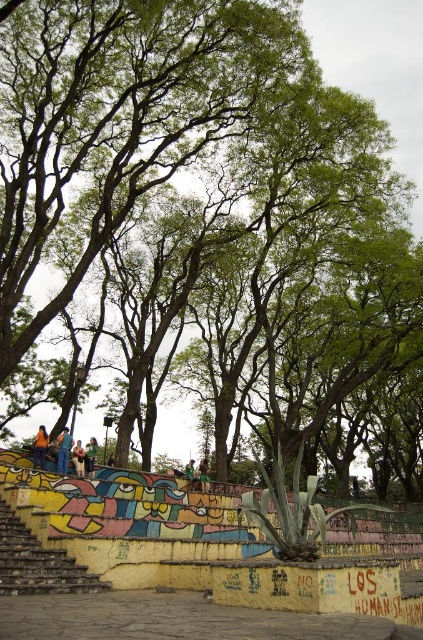
Does blue jeans at lower left come in front of orange fabric person at lower left?

Yes.

Is blue jeans at lower left positioned behind orange fabric person at lower left?

No.

Is point (57, 436) less distant than point (41, 444)?

No, (57, 436) is further to viewer.

This screenshot has height=640, width=423. I want to click on blue jeans at lower left, so click(63, 451).

Is point (33, 442) less distant than point (79, 451)?

No, (33, 442) is further to viewer.

Between orange fabric person at lower left and light brown leather jacket at lower left, which one has less height?

With less height is orange fabric person at lower left.

Who is more forward, (x=46, y=433) or (x=74, y=456)?

Point (x=74, y=456)

Image resolution: width=423 pixels, height=640 pixels. I want to click on orange fabric person at lower left, so click(40, 448).

What do you see at coordinates (40, 448) in the screenshot?
I see `orange fabric person at lower left` at bounding box center [40, 448].

Is orange fabric person at lower left smaller than green fabric shirt at center?

Incorrect, orange fabric person at lower left is not smaller in size than green fabric shirt at center.

The image size is (423, 640). In order to click on orange fabric person at lower left in this screenshot , I will do `click(40, 448)`.

Locate an element on the screen. orange fabric person at lower left is located at coordinates (40, 448).